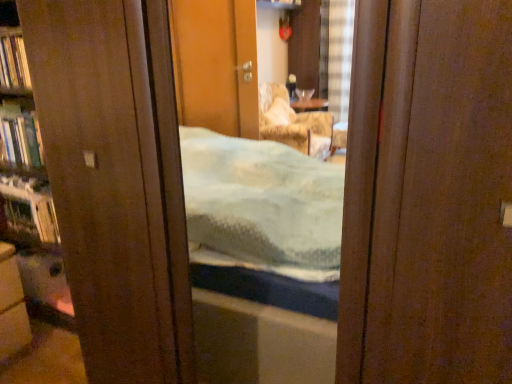
Question: Is metallic silver shelf at left closer to the viewer compared to matte brown cabinet at lower left?

Choices:
 (A) yes
 (B) no

Answer: (B)

Question: From a real-world perspective, is metallic silver shelf at left located beneath matte brown cabinet at lower left?

Choices:
 (A) no
 (B) yes

Answer: (A)

Question: From a real-world perspective, is metallic silver shelf at left on top of matte brown cabinet at lower left?

Choices:
 (A) no
 (B) yes

Answer: (B)

Question: Can we say metallic silver shelf at left lies outside matte brown cabinet at lower left?

Choices:
 (A) yes
 (B) no

Answer: (A)

Question: Can you confirm if metallic silver shelf at left is shorter than matte brown cabinet at lower left?

Choices:
 (A) no
 (B) yes

Answer: (B)

Question: In the image, is hardcover book at left, the 1th book from the top, positioned in front of or behind metallic silver shelf at left?

Choices:
 (A) behind
 (B) front

Answer: (B)

Question: Is point (12, 46) positioned closer to the camera than point (7, 190)?

Choices:
 (A) closer
 (B) farther

Answer: (A)

Question: Choose the correct answer: Is hardcover book at left, the 1th book from the top, inside metallic silver shelf at left or outside it?

Choices:
 (A) outside
 (B) inside

Answer: (A)

Question: From the image's perspective, is hardcover book at left, the 1th book from the top, located above or below metallic silver shelf at left?

Choices:
 (A) above
 (B) below

Answer: (A)

Question: Does point (17, 233) appear closer or farther from the camera than point (28, 337)?

Choices:
 (A) farther
 (B) closer

Answer: (A)

Question: From the image's perspective, is metallic silver shelf at left located above or below matte brown cabinet at lower left?

Choices:
 (A) above
 (B) below

Answer: (A)

Question: Based on their sizes in the image, would you say metallic silver shelf at left is bigger or smaller than matte brown cabinet at lower left?

Choices:
 (A) small
 (B) big

Answer: (A)

Question: Is metallic silver shelf at left spatially inside matte brown cabinet at lower left, or outside of it?

Choices:
 (A) outside
 (B) inside

Answer: (A)

Question: Choose the correct answer: Is matte brown cabinet at lower left inside hardcover book at left, the 1th book from the top, or outside it?

Choices:
 (A) outside
 (B) inside

Answer: (A)

Question: Is point (27, 337) positioned closer to the camera than point (19, 64)?

Choices:
 (A) farther
 (B) closer

Answer: (B)